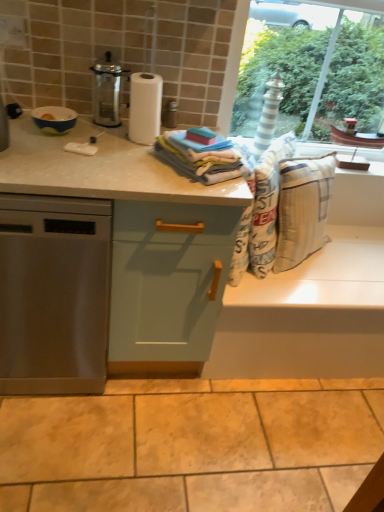
Locate an element on the screen. vacant region to the right of matte ceramic bowl at upper left is located at coordinates (x=100, y=143).